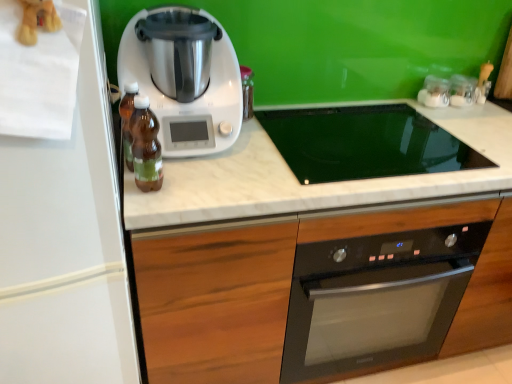
Find the location of a particular element. Image resolution: width=512 pixels, height=384 pixels. free space in front of clear glass jars at upper right, which appears as the first appliance when viewed from the left is located at coordinates (439, 114).